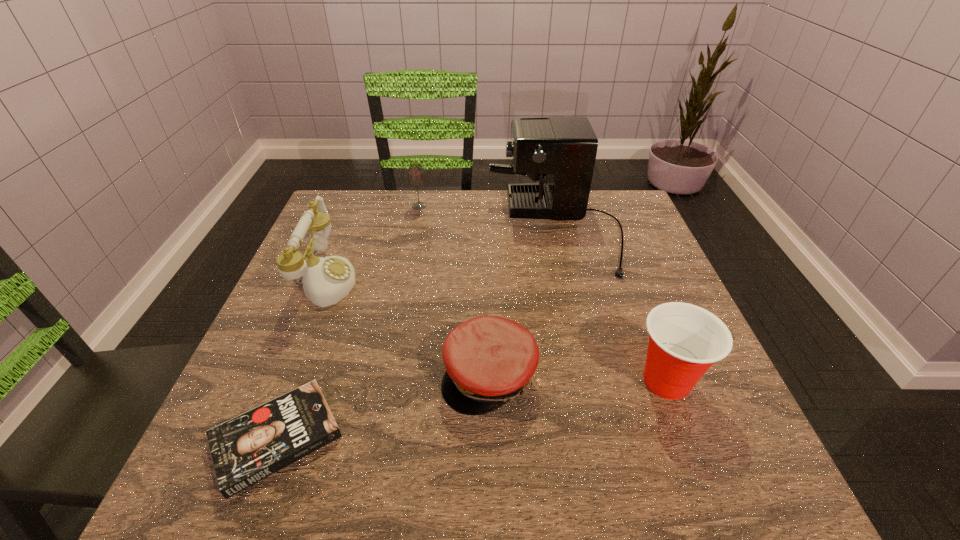
Where is `vacant space located on the front of the cup`? This screenshot has width=960, height=540. vacant space located on the front of the cup is located at coordinates (701, 471).

Image resolution: width=960 pixels, height=540 pixels. Find the location of `vacant region located on the front of the fourth object from right to left`. vacant region located on the front of the fourth object from right to left is located at coordinates (415, 231).

The height and width of the screenshot is (540, 960). I want to click on vacant space located on the back of the shortest object, so click(313, 341).

You are a GUI agent. You are given a task and a screenshot of the screen. Output one action in this format:
    pyautogui.click(x=<x>, y=<y>)
    Task: Click on the coffee maker located at the far edge
    
    Given the screenshot: What is the action you would take?
    pyautogui.click(x=564, y=149)

The image size is (960, 540). In order to click on glass drink container that is at the far edge in this screenshot , I will do `click(416, 178)`.

Find the location of `object that is at the near edge`. object that is at the near edge is located at coordinates (246, 449).

Find the location of a particular element. The image size is (960, 540). telephone located in the left edge section of the desktop is located at coordinates (326, 280).

This screenshot has height=540, width=960. In order to click on book positioned at the left edge in this screenshot , I will do `click(246, 449)`.

Where is `coffee maker that is positioned at the right edge`? This screenshot has height=540, width=960. coffee maker that is positioned at the right edge is located at coordinates (564, 149).

The height and width of the screenshot is (540, 960). I want to click on cup that is at the right edge, so click(685, 340).